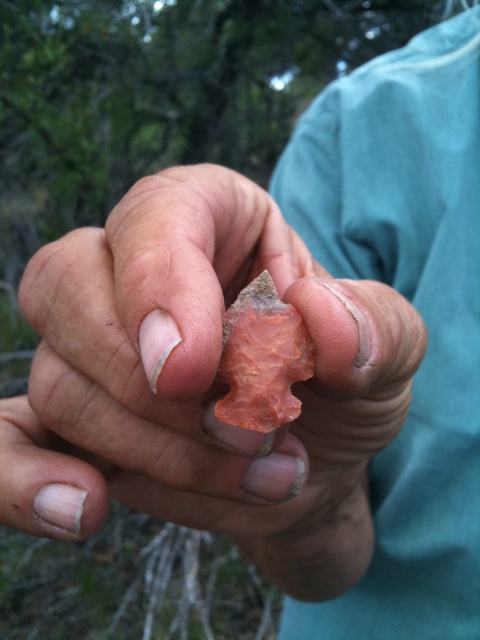
Is matte orange stone arrowhead at center taller than matte orange stone at center?

Indeed, matte orange stone arrowhead at center has a greater height compared to matte orange stone at center.

Between matte orange stone arrowhead at center and matte orange stone at center, which one is positioned lower?

matte orange stone arrowhead at center

Image resolution: width=480 pixels, height=640 pixels. What do you see at coordinates (216, 365) in the screenshot?
I see `matte orange stone arrowhead at center` at bounding box center [216, 365].

Image resolution: width=480 pixels, height=640 pixels. I want to click on matte orange stone arrowhead at center, so click(216, 365).